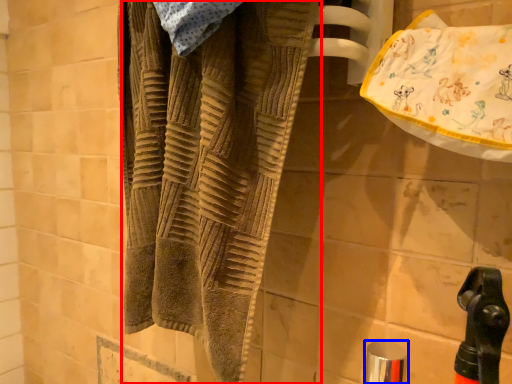
Question: Among these objects, which one is farthest to the camera, towel (highlighted by a red box) or faucet (highlighted by a blue box)?

Choices:
 (A) towel
 (B) faucet

Answer: (B)